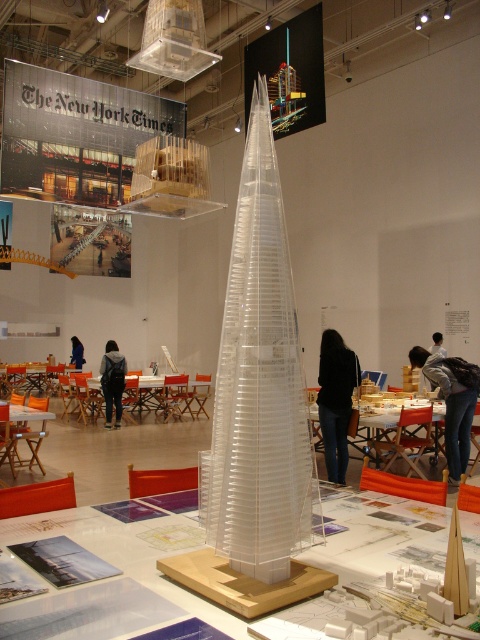
You are an architect standing at the entrance of the exhibition hall and want to reach the dark blue jacket at center. Is the transparent plastic tower at center blocking your direct path?

The transparent plastic tower at center is closer to the viewer than dark blue jacket at center, so it is blocking the direct path to the dark blue jacket at center.

You are attending an architectural exhibition and notice a dark blue jacket at center. Where exactly is the dark blue jacket positioned in the room?

The dark blue jacket at center is located at point (112, 380) in the room.